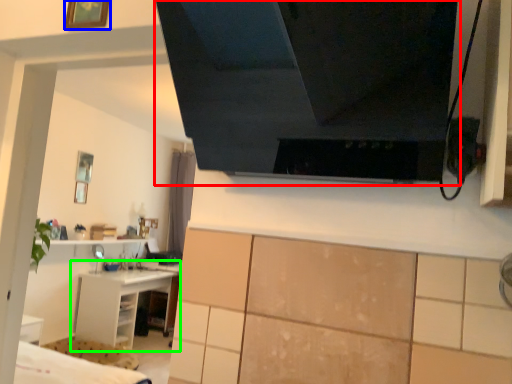
Question: Which object is positioned farthest from exhaust hood (highlighted by a red box)? Select from picture frame (highlighted by a blue box) and shelf (highlighted by a green box).

Choices:
 (A) picture frame
 (B) shelf

Answer: (B)